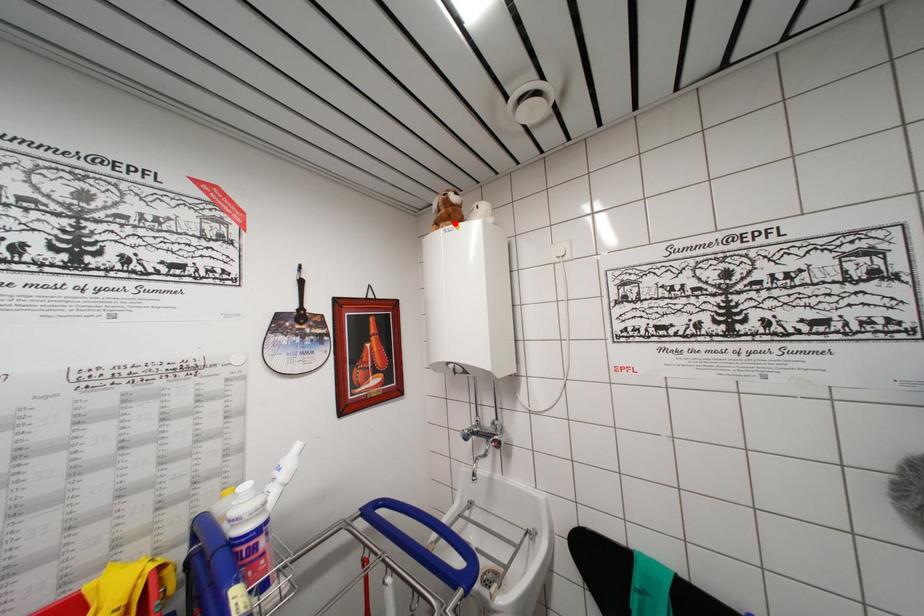
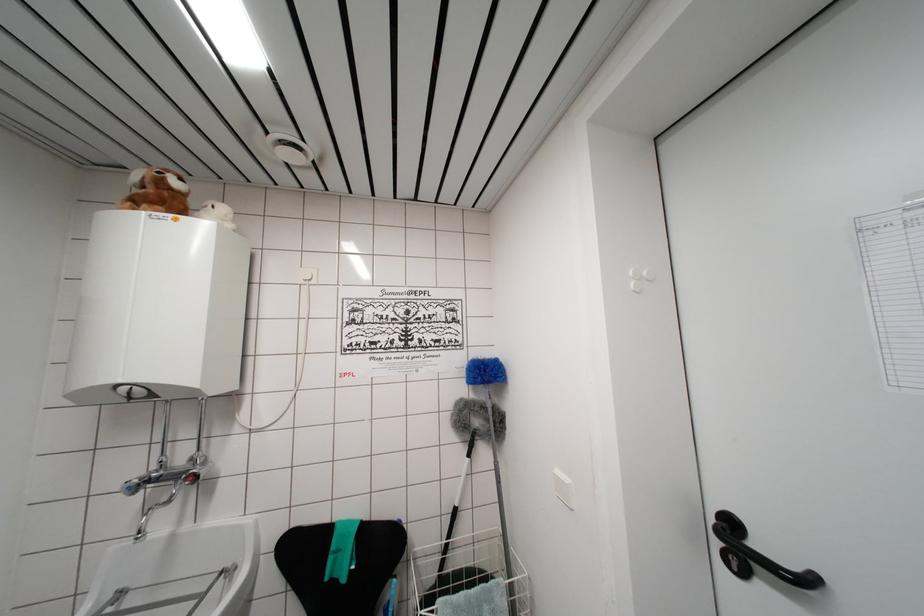
In the second image, find the point that corresponds to the highlighted location in the first image.

(168, 209)